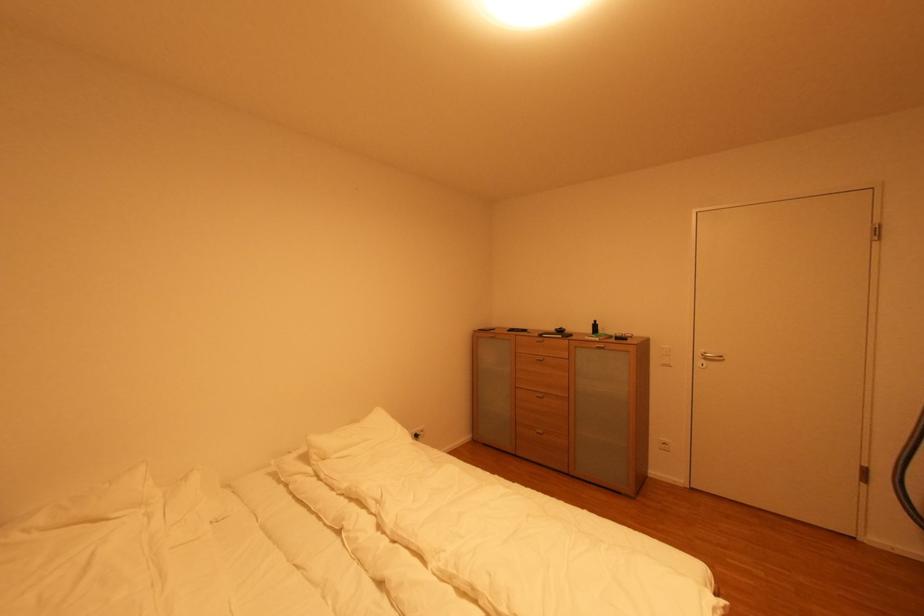
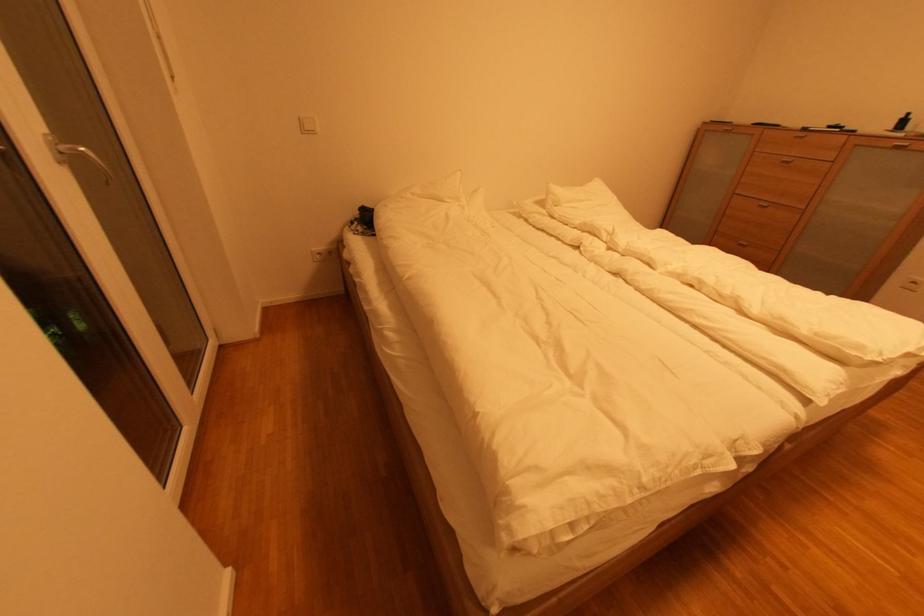
Where in the second image is the point corresponding to point (599, 323) from the first image?

(908, 118)